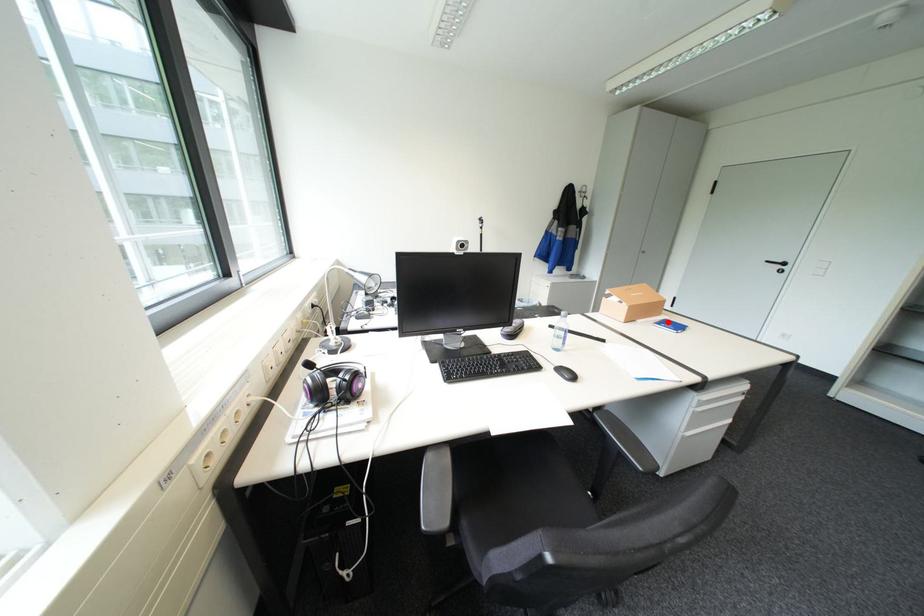
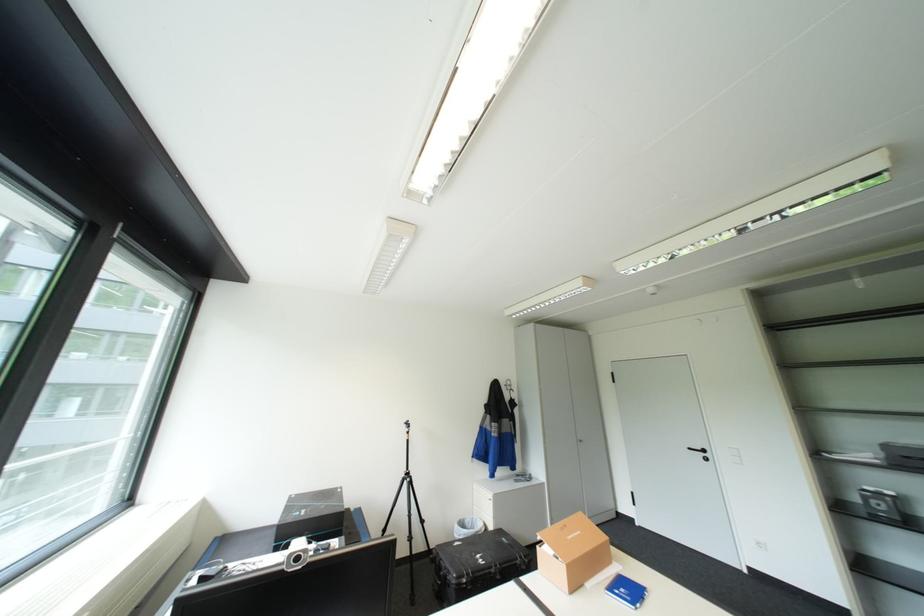
Find the pixel in the second image that matches the highlighted location in the first image.

(619, 588)